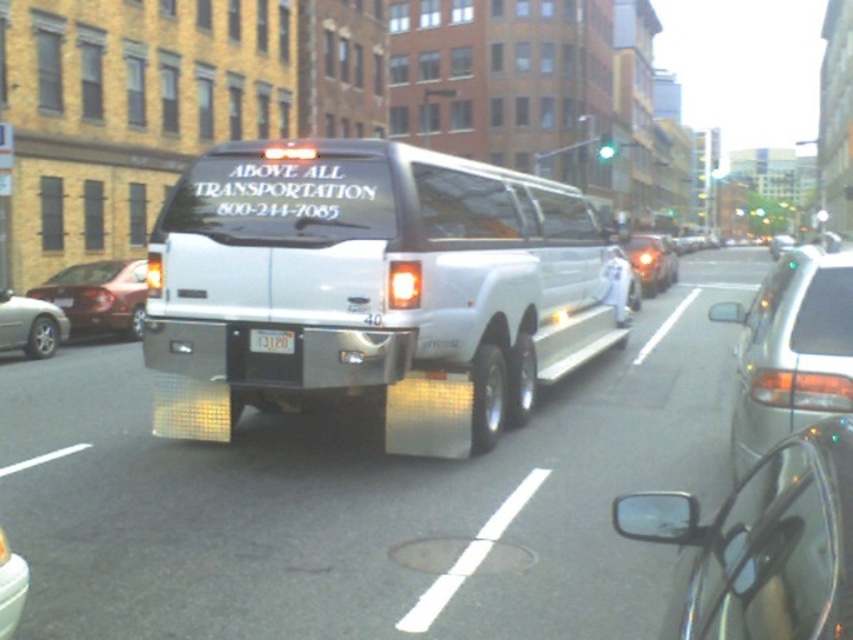
Question: Is metallic silver car at lower left positioned in front of black plastic license plate at center?

Choices:
 (A) yes
 (B) no

Answer: (A)

Question: Which point is closer to the camera taking this photo?

Choices:
 (A) (253, 337)
 (B) (20, 600)

Answer: (B)

Question: Among these objects, which one is farthest from the camera?

Choices:
 (A) shiny chrome car at center
 (B) metallic silver sedan at right

Answer: (A)

Question: Which of these objects is positioned farthest from the silver metallic sedan at left?

Choices:
 (A) metallic red sedan at left
 (B) shiny chrome car at center
 (C) metallic silver sedan at right

Answer: (B)

Question: Does silver metallic sedan at left have a greater width compared to metallic silver car at lower left?

Choices:
 (A) yes
 (B) no

Answer: (A)

Question: Considering the relative positions of silver metallic sedan at left and metallic silver car at lower left in the image provided, where is silver metallic sedan at left located with respect to metallic silver car at lower left?

Choices:
 (A) above
 (B) below

Answer: (A)